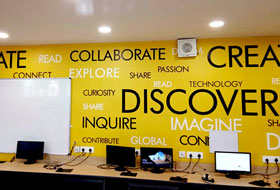
Identify the location of yellow wall. This screenshot has height=190, width=280. point(156,125).